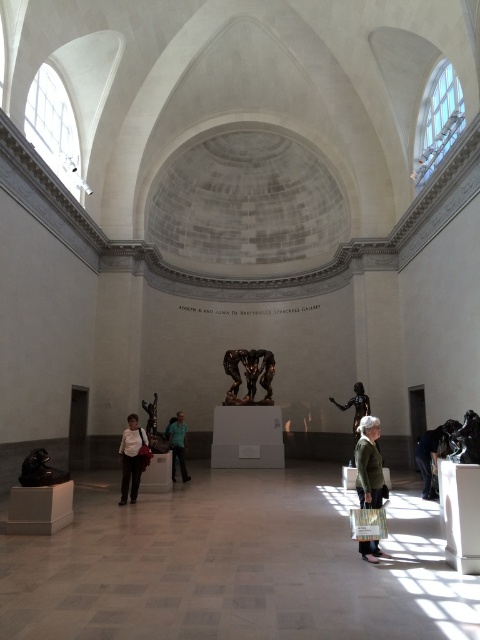
Question: Is shiny black sculpture at lower left smaller than teal fabric shirt at center?

Choices:
 (A) yes
 (B) no

Answer: (B)

Question: Which object is closer to the camera taking this photo?

Choices:
 (A) white matte shirt at center
 (B) shiny black sculpture at lower left
 (C) matte black jacket at lower right

Answer: (B)

Question: Which point is closer to the camera?

Choices:
 (A) green textured sweater at center
 (B) shiny black sculpture at lower left

Answer: (A)

Question: Which is farther from the bronze statue at center?

Choices:
 (A) white matte shirt at center
 (B) green textured sweater at center
 (C) bronze/metallic figure at center

Answer: (A)

Question: Is green textured sweater at center smaller than bronze statue at center?

Choices:
 (A) yes
 (B) no

Answer: (A)

Question: Is matte black jacket at lower right thinner than shiny black sculpture at lower left?

Choices:
 (A) yes
 (B) no

Answer: (A)